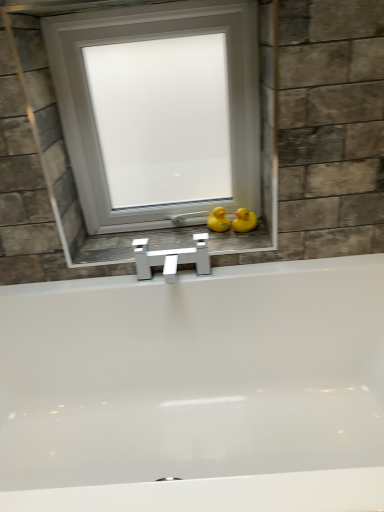
Question: Considering the relative sizes of yellow rubber duck at right, the first duck when ordered from right to left, and white glossy faucet at center in the image provided, is yellow rubber duck at right, the first duck when ordered from right to left, thinner than white glossy faucet at center?

Choices:
 (A) yes
 (B) no

Answer: (A)

Question: Is yellow rubber duck at right, acting as the second duck starting from the left, taller than white glossy faucet at center?

Choices:
 (A) no
 (B) yes

Answer: (B)

Question: Can you confirm if yellow rubber duck at right, acting as the second duck starting from the left, is shorter than white glossy faucet at center?

Choices:
 (A) yes
 (B) no

Answer: (B)

Question: From a real-world perspective, does yellow rubber duck at right, acting as the second duck starting from the left, stand above white glossy faucet at center?

Choices:
 (A) no
 (B) yes

Answer: (B)

Question: Is yellow rubber duck at right, acting as the second duck starting from the left, next to white glossy faucet at center and touching it?

Choices:
 (A) yes
 (B) no

Answer: (B)

Question: Does yellow rubber duck at right, the first duck when ordered from right to left, have a smaller size compared to white glossy faucet at center?

Choices:
 (A) no
 (B) yes

Answer: (B)

Question: Does white glossy faucet at center have a greater height compared to yellow rubber duck at center, which is the 2th duck in right-to-left order?

Choices:
 (A) yes
 (B) no

Answer: (B)

Question: From a real-world perspective, is white glossy faucet at center over yellow rubber duck at center, which is the 2th duck in right-to-left order?

Choices:
 (A) no
 (B) yes

Answer: (A)

Question: Considering the relative positions of white glossy faucet at center and yellow rubber duck at center, the first duck in the left-to-right sequence, in the image provided, is white glossy faucet at center to the left of yellow rubber duck at center, the first duck in the left-to-right sequence, from the viewer's perspective?

Choices:
 (A) yes
 (B) no

Answer: (A)

Question: Does white glossy faucet at center turn towards yellow rubber duck at center, the first duck in the left-to-right sequence?

Choices:
 (A) no
 (B) yes

Answer: (A)

Question: Does white glossy faucet at center touch yellow rubber duck at center, which is the 2th duck in right-to-left order?

Choices:
 (A) no
 (B) yes

Answer: (A)

Question: Is white glossy faucet at center thinner than yellow rubber duck at center, which is the 2th duck in right-to-left order?

Choices:
 (A) no
 (B) yes

Answer: (A)

Question: Considering the relative positions of yellow rubber duck at center, the first duck in the left-to-right sequence, and yellow rubber duck at right, acting as the second duck starting from the left, in the image provided, is yellow rubber duck at center, the first duck in the left-to-right sequence, behind yellow rubber duck at right, acting as the second duck starting from the left,?

Choices:
 (A) no
 (B) yes

Answer: (B)